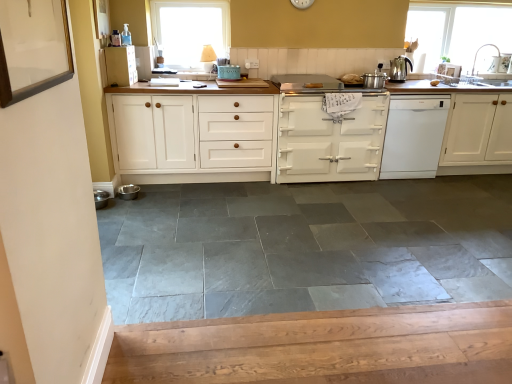
Question: From the image's perspective, is gray slate tile at center above or below polished stainless steel kettle at upper right?

Choices:
 (A) above
 (B) below

Answer: (B)

Question: Considering their positions, is gray slate tile at center located in front of or behind polished stainless steel kettle at upper right?

Choices:
 (A) front
 (B) behind

Answer: (A)

Question: Which of these objects is positioned farthest from the matte green enamel stove at center, marked as the 2th appliance in a left-to-right arrangement?

Choices:
 (A) white glossy dishwasher at right
 (B) white wood cabinet at upper center, the 1th cabinetry from the left
 (C) white painted wood cabinet at center, which is counted as the third cabinetry, starting from the right
 (D) gray slate tile at center
 (E) transparent glass window at upper right, the 2th window in the left-to-right sequence

Answer: (E)

Question: Which of these objects is positioned farthest from the white glass window at upper center, which appears as the second window when viewed from the right?

Choices:
 (A) gray slate tile at center
 (B) satin silver pot at upper right, which is the 2th appliance from front to back
 (C) matte green enamel stove at center, the 3th appliance positioned from the bottom
 (D) white wood cabinet at upper center, the 4th cabinetry when ordered from right to left
 (E) transparent glass window at upper right, the first window positioned from the back

Answer: (E)